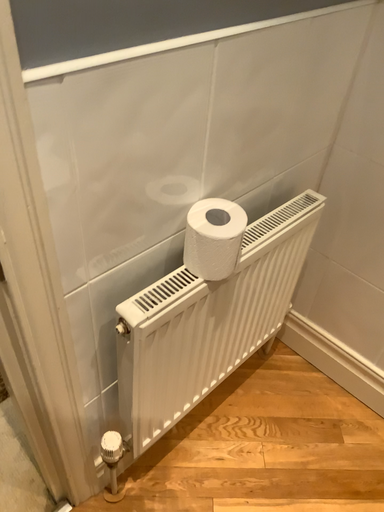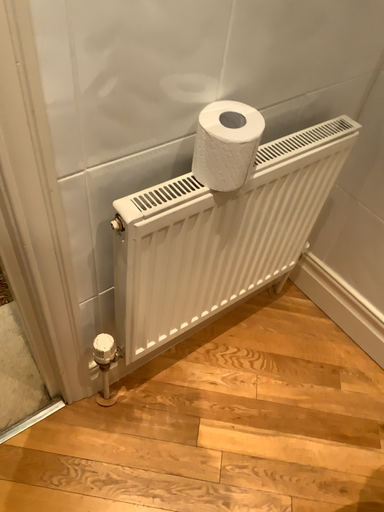
Question: How did the camera likely rotate when shooting the video?

Choices:
 (A) rotated downward
 (B) rotated upward

Answer: (A)